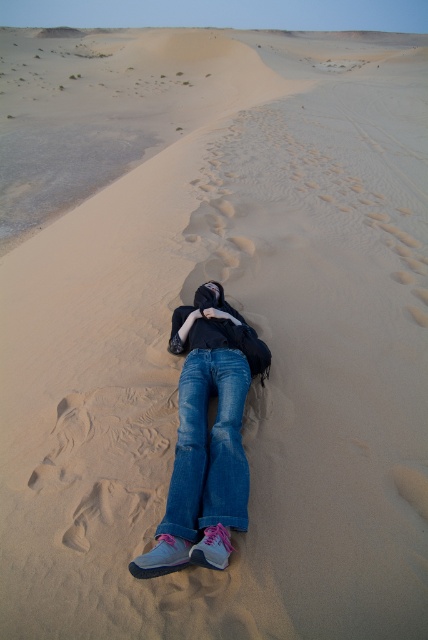
Based on the photo, you are a photographer trying to capture the scene of a person resting on a desert dune. You notice two denim items at the center of the image. How far apart are the blue denim jeans at center and the denim at center?

The distance between the blue denim jeans at center and the denim at center is 1.80 inches.

You are a photographer trying to capture the blue denim jeans at center in a closeup shot. Based on the coordinates provided, where should you position your camera relative to the jeans?

The blue denim jeans at center are located at the 2D coordinates point (207,440). To capture them in a closeup, position your camera directly facing this coordinate point for optimal framing.